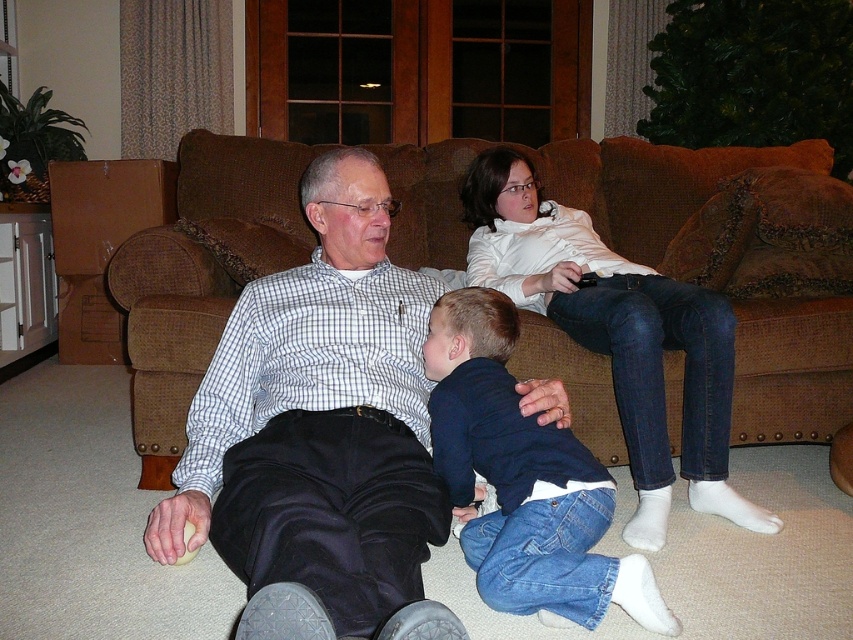
You are a guest entering the living room and want to sit down on the brown fabric couch at center. However, there are dark blue denim jeans at lower center in the way. Can you walk around them to reach the couch?

The dark blue denim jeans at lower center are behind the brown fabric couch at center, so you can walk around them to reach the couch.

Looking at this image, you are a photographer trying to capture a closeup of the white checkered shirt at center and the white matte shirt at upper center. Which shirt should you focus on first to ensure it appears sharp in the photo?

You should focus on the white checkered shirt at center first because it is closer to the viewer than the white matte shirt at upper center, so focusing on it will ensure it appears sharp while the background subject may be slightly blurred.